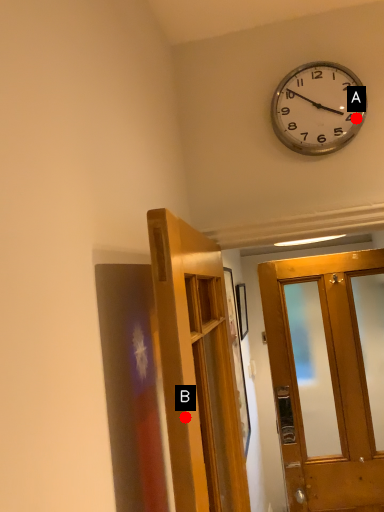
Question: Two points are circled on the image, labeled by A and B beside each circle. Which point is closer to the camera?

Choices:
 (A) A is closer
 (B) B is closer

Answer: (B)